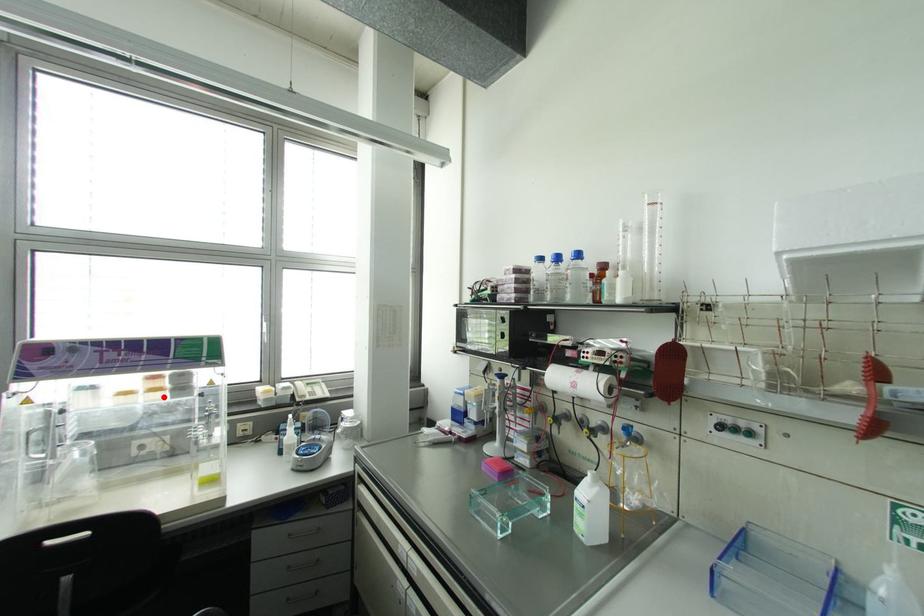
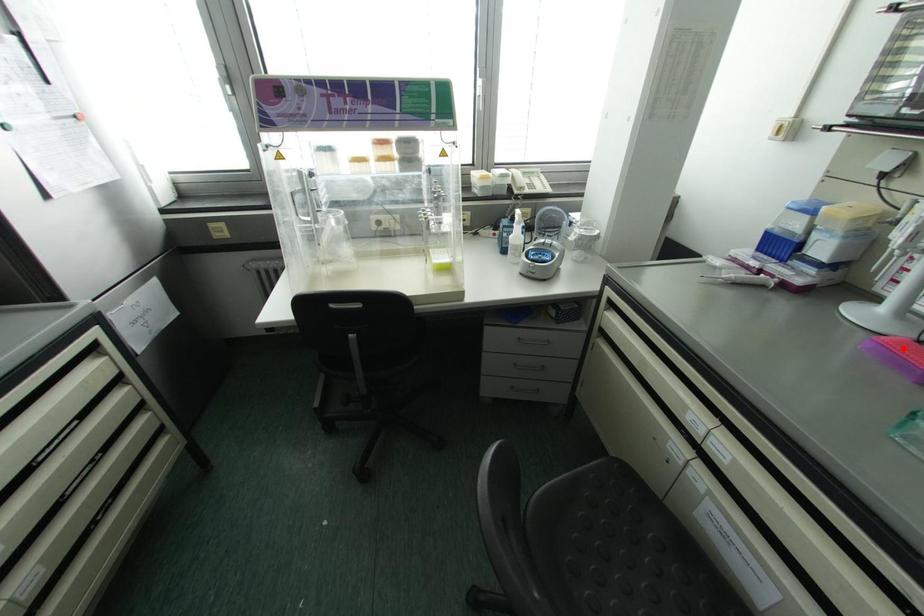
I am providing you with two images of the same scene from different viewpoints. A red point is marked on the first image and another point is marked on the second image. Are the points marked in image1 and image2 representing the same 3D position?

No